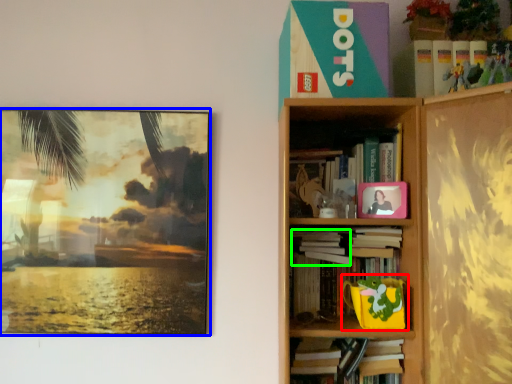
Question: Which object is the closest to the toy (highlighted by a red box)? Choose among these: picture frame (highlighted by a blue box) or book (highlighted by a green box).

Choices:
 (A) picture frame
 (B) book

Answer: (B)